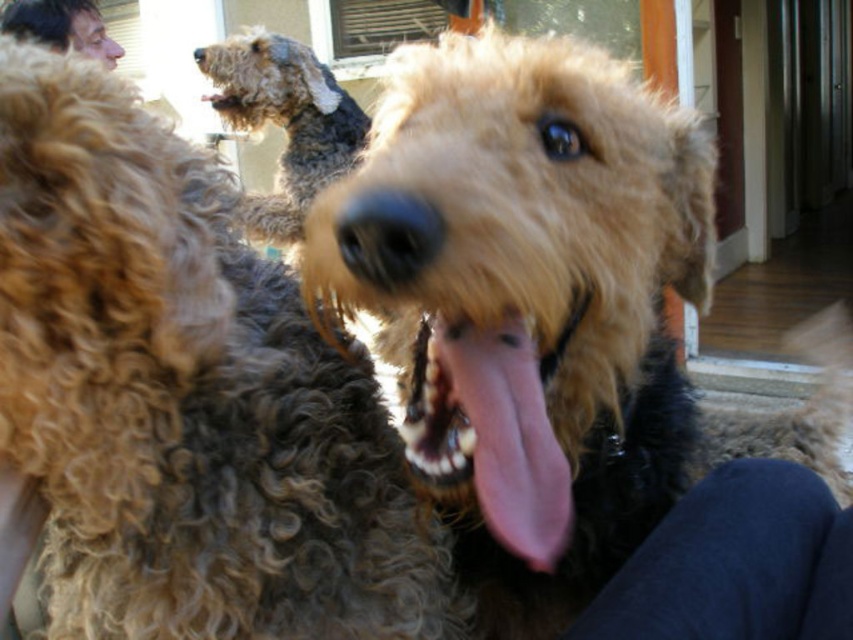
Which is above, pink glossy tongue at center or brown curly fur at upper center?

brown curly fur at upper center is above.

Is point (552, 520) positioned before point (213, 93)?

That is True.

Find the location of a particular element. The image size is (853, 640). pink glossy tongue at center is located at coordinates (491, 433).

In the scene shown: Is fuzzy brown dog at center positioned at the back of brown curly fur at upper center?

No, fuzzy brown dog at center is closer to the viewer.

What do you see at coordinates (538, 307) in the screenshot? I see `fuzzy brown dog at center` at bounding box center [538, 307].

Identify the location of fuzzy brown dog at center. (538, 307).

Does curly golden fur dog at center appear over brown curly fur at upper center?

No.

Between curly golden fur dog at center and brown curly fur at upper center, which one is positioned lower?

curly golden fur dog at center is lower down.

The image size is (853, 640). What do you see at coordinates (184, 396) in the screenshot? I see `curly golden fur dog at center` at bounding box center [184, 396].

Identify the location of curly golden fur dog at center. The height and width of the screenshot is (640, 853). (184, 396).